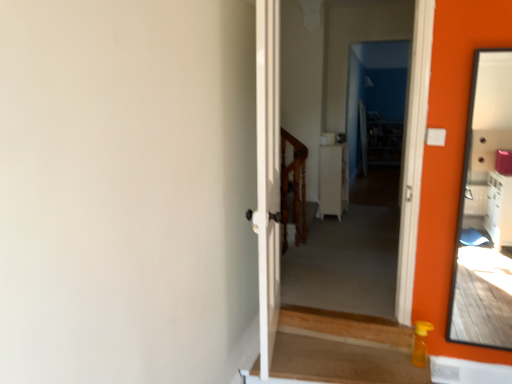
Question: Considering the relative sizes of matte orange mirror at right and wooden at center in the image provided, is matte orange mirror at right taller than wooden at center?

Choices:
 (A) yes
 (B) no

Answer: (A)

Question: From the image's perspective, does matte orange mirror at right appear higher than wooden at center?

Choices:
 (A) yes
 (B) no

Answer: (A)

Question: Can you confirm if matte orange mirror at right is shorter than wooden at center?

Choices:
 (A) yes
 (B) no

Answer: (B)

Question: Could you tell me if matte orange mirror at right is facing wooden at center?

Choices:
 (A) yes
 (B) no

Answer: (B)

Question: Can you confirm if matte orange mirror at right is thinner than wooden at center?

Choices:
 (A) yes
 (B) no

Answer: (A)

Question: Looking at their shapes, would you say wooden at center is wider or thinner than white glossy cabinet at center?

Choices:
 (A) wide
 (B) thin

Answer: (B)

Question: From a real-world perspective, is wooden at center positioned above or below white glossy cabinet at center?

Choices:
 (A) below
 (B) above

Answer: (A)

Question: From the image's perspective, relative to white glossy cabinet at center, is wooden at center above or below?

Choices:
 (A) below
 (B) above

Answer: (A)

Question: Considering the positions of wooden at center and white glossy cabinet at center in the image, is wooden at center bigger or smaller than white glossy cabinet at center?

Choices:
 (A) big
 (B) small

Answer: (B)

Question: Relative to wooden at center, is matte orange mirror at right in front or behind?

Choices:
 (A) behind
 (B) front

Answer: (B)

Question: Would you say matte orange mirror at right is inside or outside wooden at center?

Choices:
 (A) outside
 (B) inside

Answer: (A)

Question: From the image's perspective, is matte orange mirror at right above or below wooden at center?

Choices:
 (A) below
 (B) above

Answer: (B)

Question: In the image, is matte orange mirror at right on the left side or the right side of wooden at center?

Choices:
 (A) left
 (B) right

Answer: (B)

Question: In terms of height, does matte orange mirror at right look taller or shorter compared to white glossy cabinet at center?

Choices:
 (A) short
 (B) tall

Answer: (B)

Question: Considering the positions of matte orange mirror at right and white glossy cabinet at center in the image, is matte orange mirror at right wider or thinner than white glossy cabinet at center?

Choices:
 (A) thin
 (B) wide

Answer: (A)